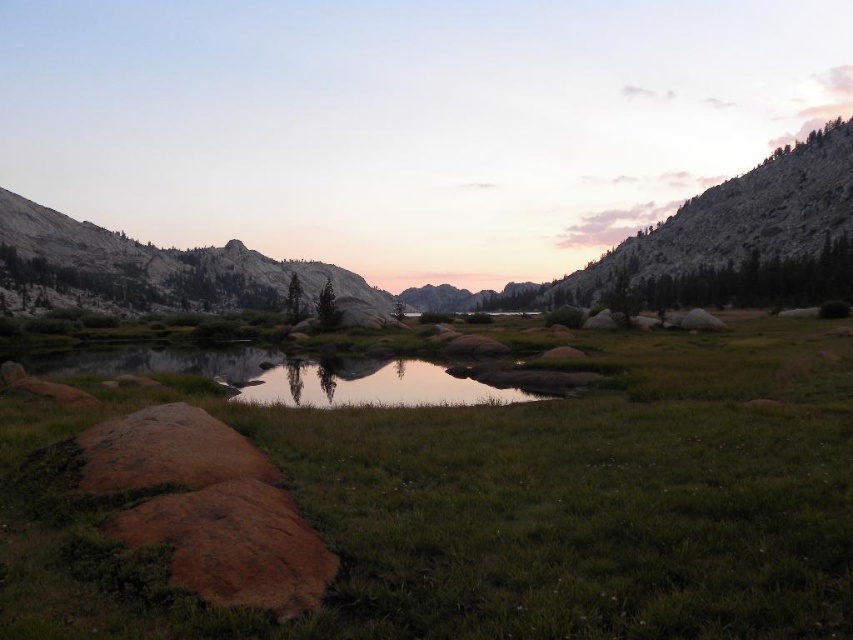
You are standing at the point with coordinates point (x=32, y=616) and want to walk towards the point (x=22, y=305). Which direction should you move in?

You should move backward because point (x=32, y=616) is in front of point (x=22, y=305), so moving backward will take you toward the desired point.

You are a hiker who wants to take a photo of the granite rock formation at upper left and the clear water at center. Which object should you focus on first if you want to capture both in one frame without moving your camera?

The granite rock formation at upper left is taller than the clear water at center, so you should focus on the granite rock formation at upper left first to ensure it fits within the frame.